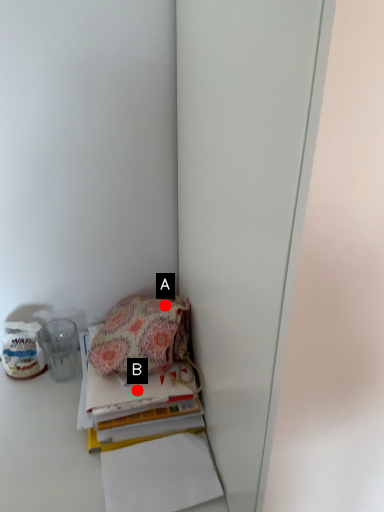
Question: Two points are circled on the image, labeled by A and B beside each circle. Among these points, which one is nearest to the camera?

Choices:
 (A) A is closer
 (B) B is closer

Answer: (B)